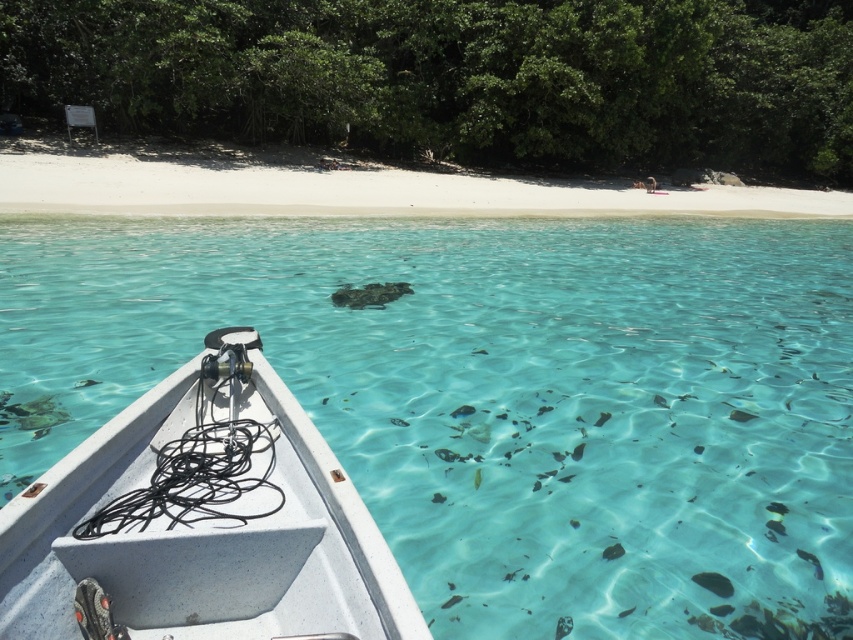
Can you confirm if clear water at center is bigger than white speckled plastic boat at center?

Yes.

Between point (172, 288) and point (32, 609), which one is positioned in front?

Point (32, 609) is more forward.

This screenshot has height=640, width=853. In order to click on clear water at center in this screenshot , I will do `click(498, 397)`.

At what (x,y) coordinates should I click in order to perform the action: click on clear water at center. Please return your answer as a coordinate pair (x, y). Looking at the image, I should click on (498, 397).

Which is below, white speckled plastic boat at center or white sand beach at upper center?

white speckled plastic boat at center is lower down.

Is white speckled plastic boat at center wider than white sand beach at upper center?

In fact, white speckled plastic boat at center might be narrower than white sand beach at upper center.

Is point (105, 474) in front of point (358, 198)?

Yes, it is.

You are a GUI agent. You are given a task and a screenshot of the screen. Output one action in this format:
    pyautogui.click(x=<x>, y=<y>)
    Task: Click on the white speckled plastic boat at center
    The width and height of the screenshot is (853, 640).
    Given the screenshot: What is the action you would take?
    pyautogui.click(x=201, y=522)

Between clear water at center and white sand beach at upper center, which one appears on the left side from the viewer's perspective?

Positioned to the left is clear water at center.

How far apart are clear water at center and white sand beach at upper center?

A distance of 7.16 meters exists between clear water at center and white sand beach at upper center.

Does point (241, 304) lie behind point (694, 204)?

No.

Where is `clear water at center`? clear water at center is located at coordinates (498, 397).